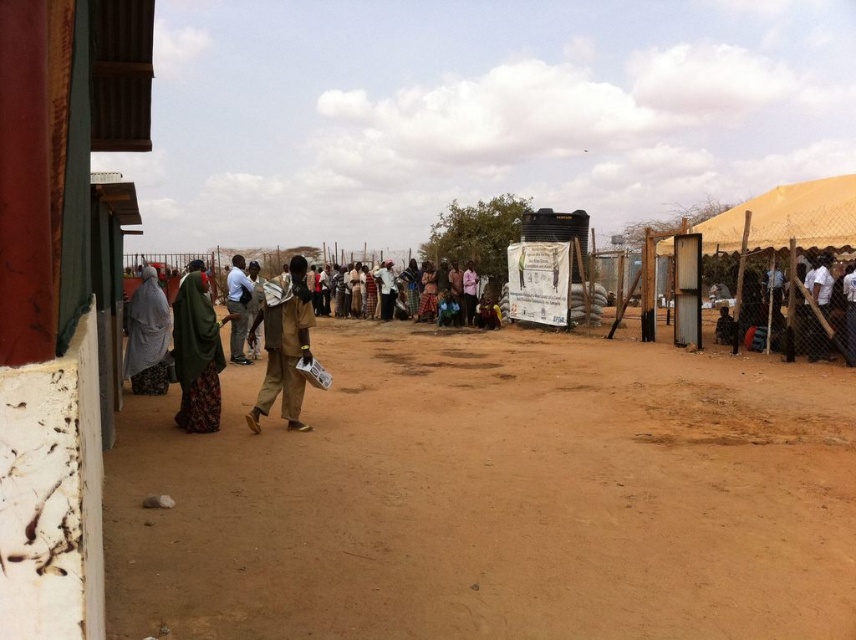
Can you confirm if rustic wood hut at left is bigger than gray fabric headscarf at left?

No, rustic wood hut at left is not bigger than gray fabric headscarf at left.

Find the location of a particular element. The width and height of the screenshot is (856, 640). rustic wood hut at left is located at coordinates (57, 296).

Measure the distance between point (60, 172) and camera.

The distance of point (60, 172) from camera is 1.82 meters.

Where is `rustic wood hut at left`? rustic wood hut at left is located at coordinates (57, 296).

Based on the photo, between brown sandy ground at center and rustic wood hut at left, which one has less height?

Standing shorter between the two is brown sandy ground at center.

Between point (419, 355) and point (0, 352), which one is positioned behind?

The point (419, 355) is more distant.

In order to click on brown sandy ground at center in this screenshot , I will do `click(495, 499)`.

Between rustic wood hut at left and green fabric headscarf at center, which one appears on the left side from the viewer's perspective?

green fabric headscarf at center

Between rustic wood hut at left and green fabric headscarf at center, which one has less height?

Standing shorter between the two is green fabric headscarf at center.

Does point (0, 534) lie behind point (198, 403)?

No, (0, 534) is closer to viewer.

Identify the location of rustic wood hut at left. This screenshot has height=640, width=856. (57, 296).